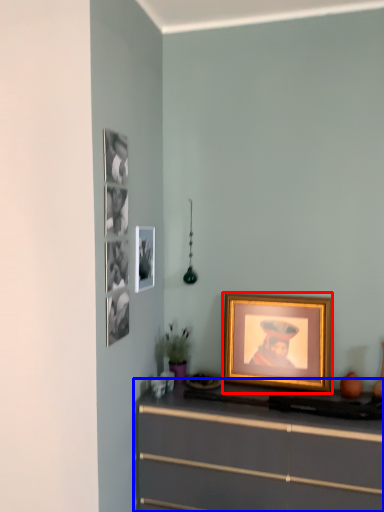
Question: Which object is closer to the camera taking this photo, picture frame (highlighted by a red box) or chest of drawers (highlighted by a blue box)?

Choices:
 (A) picture frame
 (B) chest of drawers

Answer: (B)